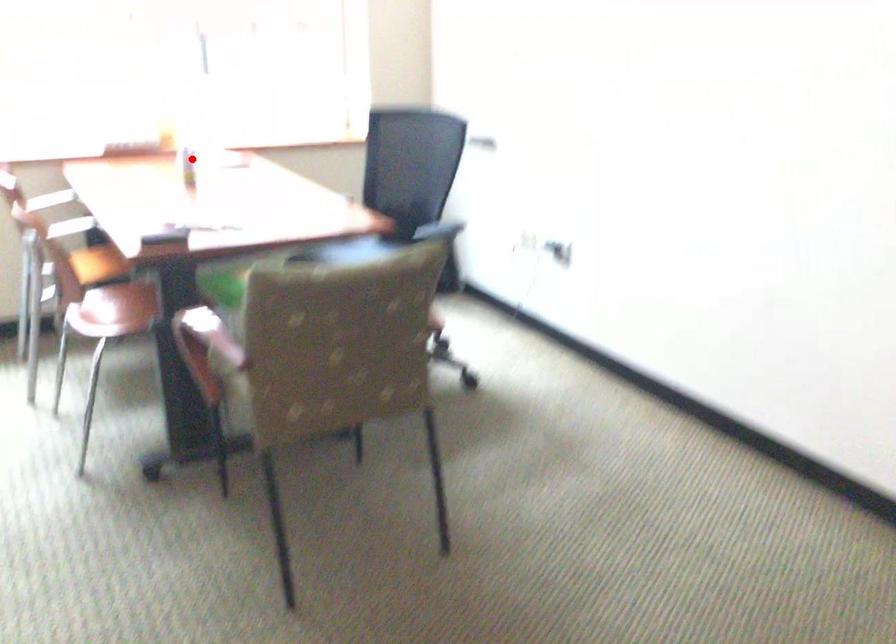
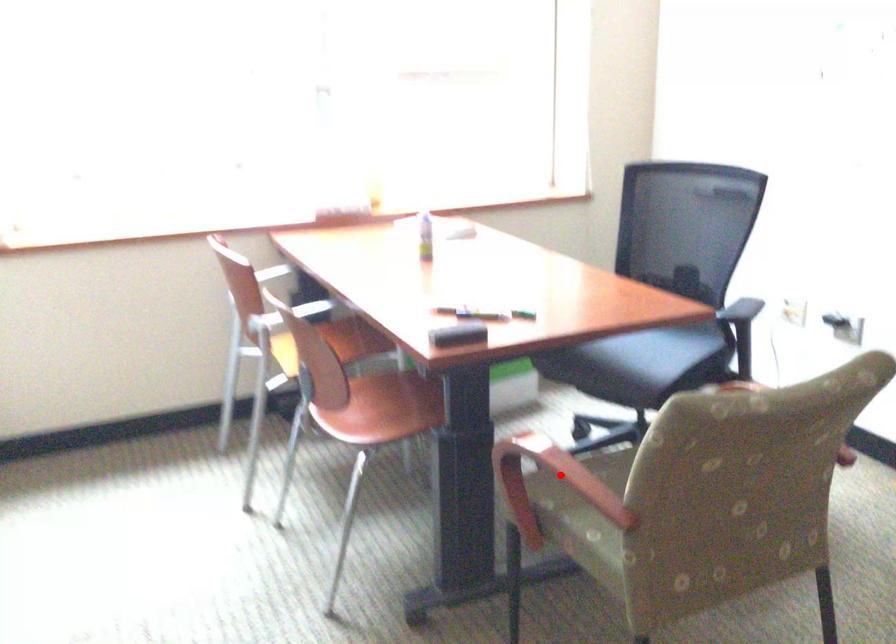
I am providing you with two images of the same scene from different viewpoints. A red point is marked on the first image and another point is marked on the second image. Do the highlighted points in image1 and image2 indicate the same real-world spot?

No